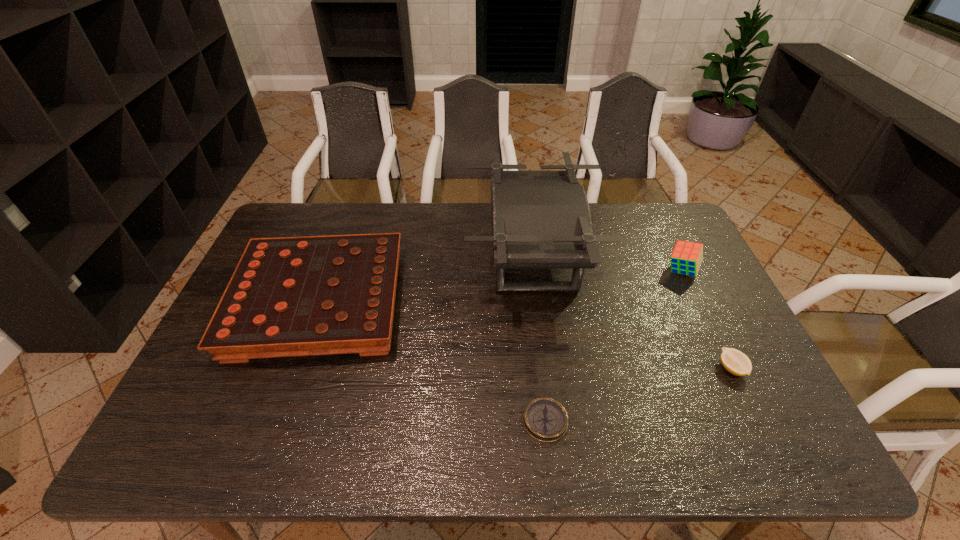
Identify the location of the tallest object. This screenshot has height=540, width=960. (540, 219).

Identify the location of cube. (686, 258).

Where is `the third tallest object`? the third tallest object is located at coordinates (315, 295).

Image resolution: width=960 pixels, height=540 pixels. I want to click on the leftmost object, so click(315, 295).

At what (x,y) coordinates should I click in order to perform the action: click on the second shortest object. Please return your answer as a coordinate pair (x, y). The height and width of the screenshot is (540, 960). Looking at the image, I should click on (734, 361).

The width and height of the screenshot is (960, 540). Find the location of `the shortest object`. the shortest object is located at coordinates (545, 419).

Image resolution: width=960 pixels, height=540 pixels. In order to click on the nearest object in this screenshot , I will do tap(545, 419).

I want to click on vacant space located 0.110m with a camera mounted on the underside of the tallest object, so click(x=433, y=259).

Find the location of a particular element. Image resolution: width=960 pixels, height=540 pixels. vacant region located 0.290m with a camera mounted on the underside of the tallest object is located at coordinates (378, 259).

The image size is (960, 540). I want to click on free region located with a camera mounted on the underside of the tallest object, so click(372, 259).